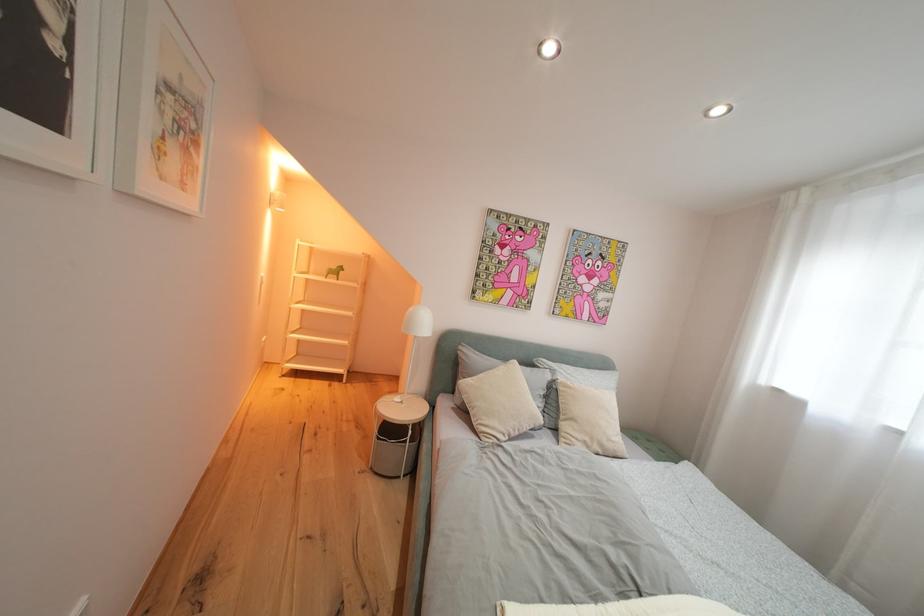
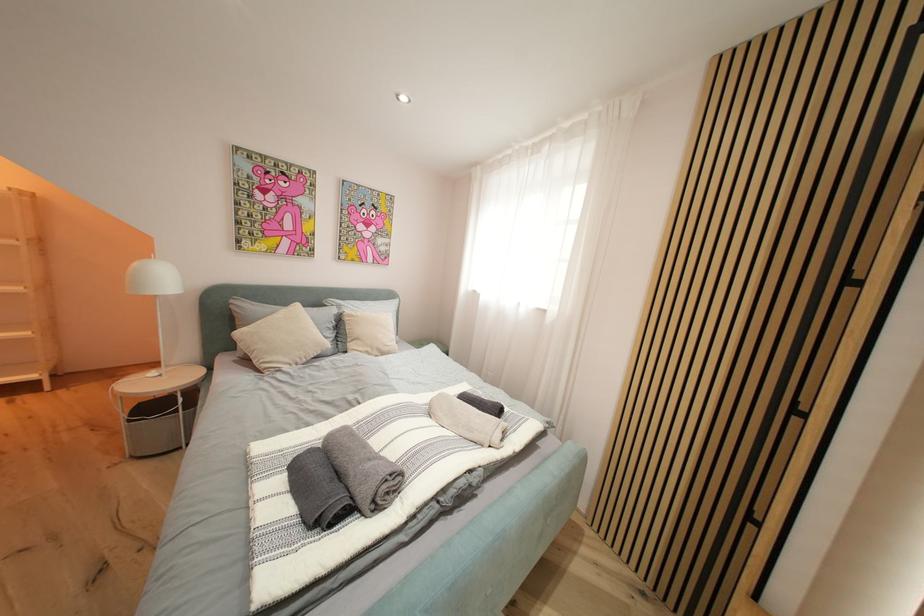
Question: The camera is either moving clockwise (left) or counter-clockwise (right) around the object. The first image is from the beginning of the video and the second image is from the end. Is the camera moving left or right when shooting the video?

Choices:
 (A) Left
 (B) Right

Answer: (A)